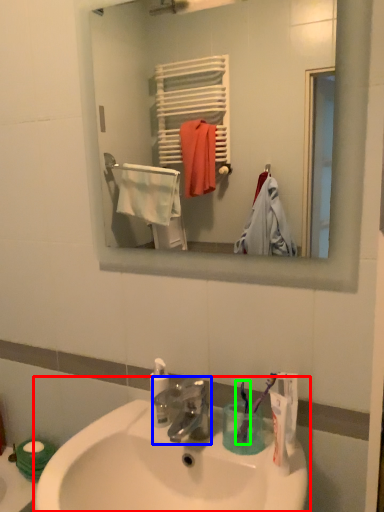
Question: Which is farther away from sink (highlighted by a red box)? tap (highlighted by a blue box) or toothbrush (highlighted by a green box)?

Choices:
 (A) tap
 (B) toothbrush

Answer: (B)